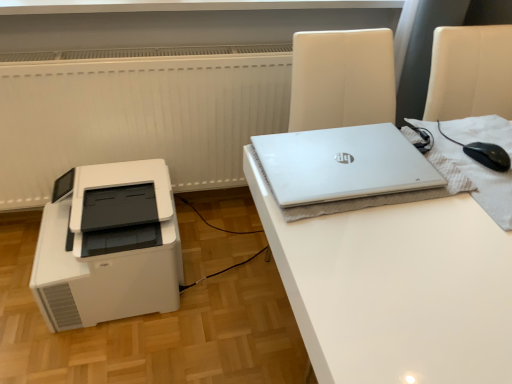
The width and height of the screenshot is (512, 384). Find the location of `black matte mouse at right`. black matte mouse at right is located at coordinates (488, 155).

At what (x,y) coordinates should I click in order to perform the action: click on white plastic printer at lower left. Please return your answer as a coordinate pair (x, y). The width and height of the screenshot is (512, 384). Looking at the image, I should click on (108, 246).

Identify the location of silver metallic laptop at upper right. (342, 164).

The height and width of the screenshot is (384, 512). What do you see at coordinates (396, 287) in the screenshot? I see `white glossy desk at upper right` at bounding box center [396, 287].

Where is `black matte mouse at right`? black matte mouse at right is located at coordinates (488, 155).

Considering the sizes of objects black matte mouse at right and white plastic printer at lower left in the image provided, who is smaller, black matte mouse at right or white plastic printer at lower left?

black matte mouse at right.

Is black matte mouse at right positioned with its back to white plastic printer at lower left?

No.

Which is behind, black matte mouse at right or white plastic printer at lower left?

white plastic printer at lower left is further from the camera.

Between black matte mouse at right and white plastic printer at lower left, which one has more height?

white plastic printer at lower left.

From the image's perspective, which one is positioned higher, black matte mouse at right or silver metallic laptop at upper right?

black matte mouse at right, from the image's perspective.

Consider the image. Between black matte mouse at right and silver metallic laptop at upper right, which one has more height?

black matte mouse at right is taller.

Does black matte mouse at right lie behind silver metallic laptop at upper right?

Yes, the depth of black matte mouse at right is greater than that of silver metallic laptop at upper right.

From a real-world perspective, relative to black matte mouse at right, is white plastic printer at lower left vertically above or below?

In terms of real-world spatial position, white plastic printer at lower left is below black matte mouse at right.

Does white plastic printer at lower left have a greater width compared to black matte mouse at right?

Correct, the width of white plastic printer at lower left exceeds that of black matte mouse at right.

Is white plastic printer at lower left inside the boundaries of black matte mouse at right, or outside?

white plastic printer at lower left is outside black matte mouse at right.

Can you confirm if white plastic printer at lower left is shorter than black matte mouse at right?

In fact, white plastic printer at lower left may be taller than black matte mouse at right.

Could you tell me if black matte mouse at right is facing white glossy desk at upper right?

No, black matte mouse at right is not facing towards white glossy desk at upper right.

From the image's perspective, is black matte mouse at right beneath white glossy desk at upper right?

No, from the image's perspective, black matte mouse at right is not beneath white glossy desk at upper right.

Between point (500, 166) and point (358, 228), which one is positioned in front?

The point (358, 228) is in front.

Based on the photo, between black matte mouse at right and white glossy desk at upper right, which one is positioned behind?

black matte mouse at right is further away from the camera.

Between silver metallic laptop at upper right and black matte mouse at right, which one has more height?

With more height is black matte mouse at right.

Could black matte mouse at right be considered to be inside silver metallic laptop at upper right?

Actually, black matte mouse at right is outside silver metallic laptop at upper right.

In terms of size, does silver metallic laptop at upper right appear bigger or smaller than black matte mouse at right?

Clearly, silver metallic laptop at upper right is larger in size than black matte mouse at right.

Which is in front, silver metallic laptop at upper right or black matte mouse at right?

Positioned in front is silver metallic laptop at upper right.

Is point (85, 242) closer to camera compared to point (441, 303)?

No.

From the picture: In terms of width, does white plastic printer at lower left look wider or thinner when compared to white glossy desk at upper right?

Considering their sizes, white plastic printer at lower left looks slimmer than white glossy desk at upper right.

In terms of size, does white plastic printer at lower left appear bigger or smaller than white glossy desk at upper right?

white plastic printer at lower left is smaller than white glossy desk at upper right.

How much distance is there between white plastic printer at lower left and white glossy desk at upper right?

The distance of white plastic printer at lower left from white glossy desk at upper right is 29.83 inches.

In the image, is silver metallic laptop at upper right positioned in front of or behind white glossy desk at upper right?

In the image, silver metallic laptop at upper right appears behind white glossy desk at upper right.

Is silver metallic laptop at upper right aimed at white glossy desk at upper right?

Yes, silver metallic laptop at upper right faces towards white glossy desk at upper right.

Visually, is silver metallic laptop at upper right positioned to the left or to the right of white glossy desk at upper right?

Clearly, silver metallic laptop at upper right is on the left of white glossy desk at upper right in the image.

What's the angular difference between silver metallic laptop at upper right and white glossy desk at upper right's facing directions?

The angle between the facing direction of silver metallic laptop at upper right and the facing direction of white glossy desk at upper right is 1.1 degrees.

Identify the location of mouse that is above the white plastic printer at lower left (from the image's perspective). (488, 155).

Where is `laptop in front of the black matte mouse at right`? The image size is (512, 384). laptop in front of the black matte mouse at right is located at coordinates (342, 164).

Based on the photo, based on their spatial positions, is white plastic printer at lower left or black matte mouse at right further from white glossy desk at upper right?

white plastic printer at lower left lies further to white glossy desk at upper right than the other object.

Estimate the real-world distances between objects in this image. Which object is closer to white plastic printer at lower left, silver metallic laptop at upper right or white glossy desk at upper right?

silver metallic laptop at upper right is positioned closer to the anchor white plastic printer at lower left.

Estimate the real-world distances between objects in this image. Which object is closer to silver metallic laptop at upper right, black matte mouse at right or white glossy desk at upper right?

Among the two, white glossy desk at upper right is located nearer to silver metallic laptop at upper right.

Considering their positions, is white plastic printer at lower left positioned closer to black matte mouse at right than silver metallic laptop at upper right?

Based on the image, silver metallic laptop at upper right appears to be nearer to black matte mouse at right.

Consider the image. Based on their spatial positions, is white glossy desk at upper right or white plastic printer at lower left closer to black matte mouse at right?

Among the two, white glossy desk at upper right is located nearer to black matte mouse at right.

Estimate the real-world distances between objects in this image. Which object is closer to silver metallic laptop at upper right, black matte mouse at right or white plastic printer at lower left?

Among the two, black matte mouse at right is located nearer to silver metallic laptop at upper right.

From the image, which object appears to be nearer to white plastic printer at lower left, white glossy desk at upper right or black matte mouse at right?

white glossy desk at upper right is positioned closer to the anchor white plastic printer at lower left.

Looking at the image, which one is located closer to white glossy desk at upper right, silver metallic laptop at upper right or black matte mouse at right?

Among the two, silver metallic laptop at upper right is located nearer to white glossy desk at upper right.

Locate an element on the screen. The image size is (512, 384). mouse located between white plastic printer at lower left and white glossy desk at upper right in the left-right direction is located at coordinates point(488,155).

Find the location of a particular element. The width and height of the screenshot is (512, 384). laptop located between white plastic printer at lower left and black matte mouse at right in the left-right direction is located at coordinates (342, 164).

The image size is (512, 384). In order to click on laptop between black matte mouse at right and white glossy desk at upper right from top to bottom in this screenshot , I will do `click(342, 164)`.

Identify the location of laptop situated between white plastic printer at lower left and white glossy desk at upper right from left to right. (342, 164).